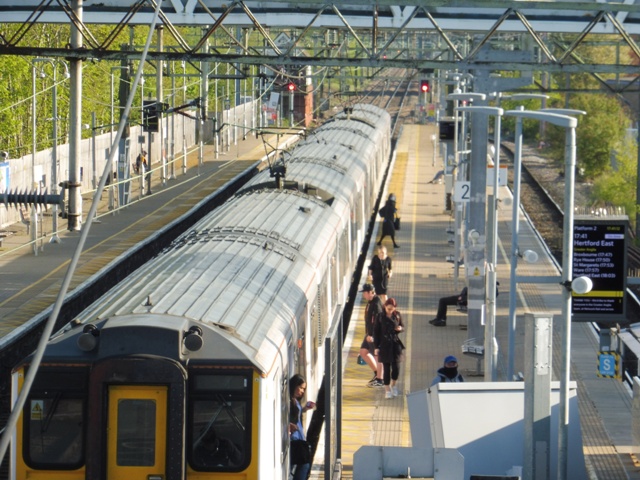
Image resolution: width=640 pixels, height=480 pixels. In order to click on window in this screenshot , I will do `click(59, 428)`, `click(134, 425)`, `click(214, 429)`.